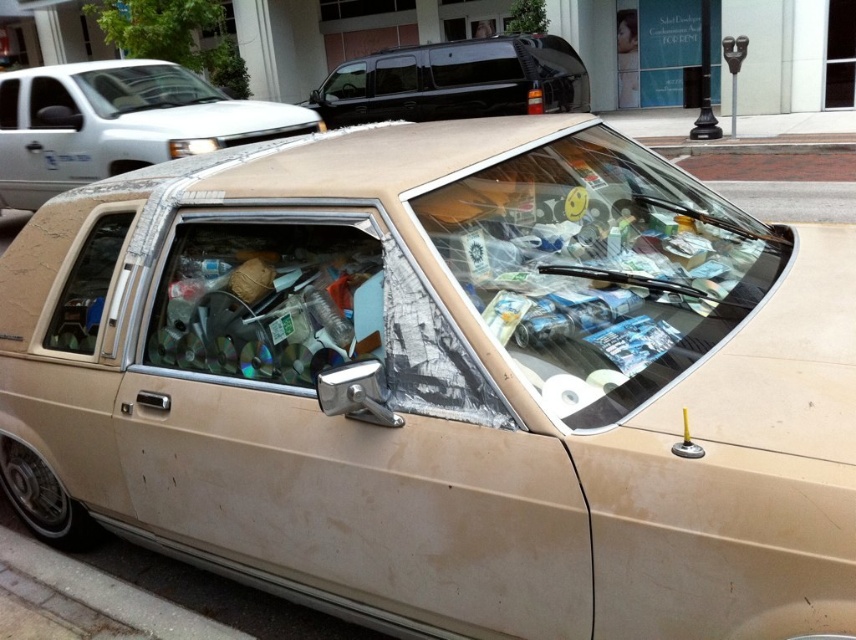
Who is shorter, beige matte car at center or concrete at lower left?

Standing shorter between the two is concrete at lower left.

Describe the element at coordinates (117, 122) in the screenshot. I see `beige matte car at center` at that location.

Between point (13, 147) and point (220, 628), which one is positioned behind?

Positioned behind is point (13, 147).

Identify the location of beige matte car at center. The image size is (856, 640). (117, 122).

Is transparent plastic windshield at center below beige matte car at center?

Yes.

Is transparent plastic windshield at center wider than beige matte car at center?

Yes, transparent plastic windshield at center is wider than beige matte car at center.

Is point (652, 236) more distant than point (117, 93)?

No.

This screenshot has height=640, width=856. I want to click on transparent plastic windshield at center, so click(599, 268).

What do you see at coordinates (599, 268) in the screenshot?
I see `transparent plastic windshield at center` at bounding box center [599, 268].

Does transparent plastic windshield at center have a lesser width compared to concrete at lower left?

No, transparent plastic windshield at center is not thinner than concrete at lower left.

Between point (596, 428) and point (126, 582), which one is positioned behind?

The point (126, 582) is more distant.

What are the coordinates of `transparent plastic windshield at center` in the screenshot? It's located at (599, 268).